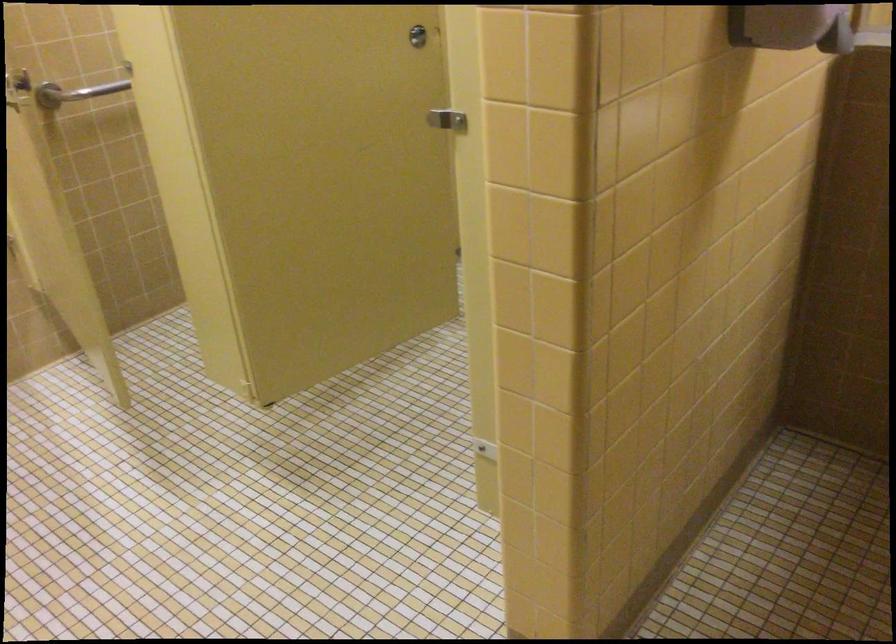
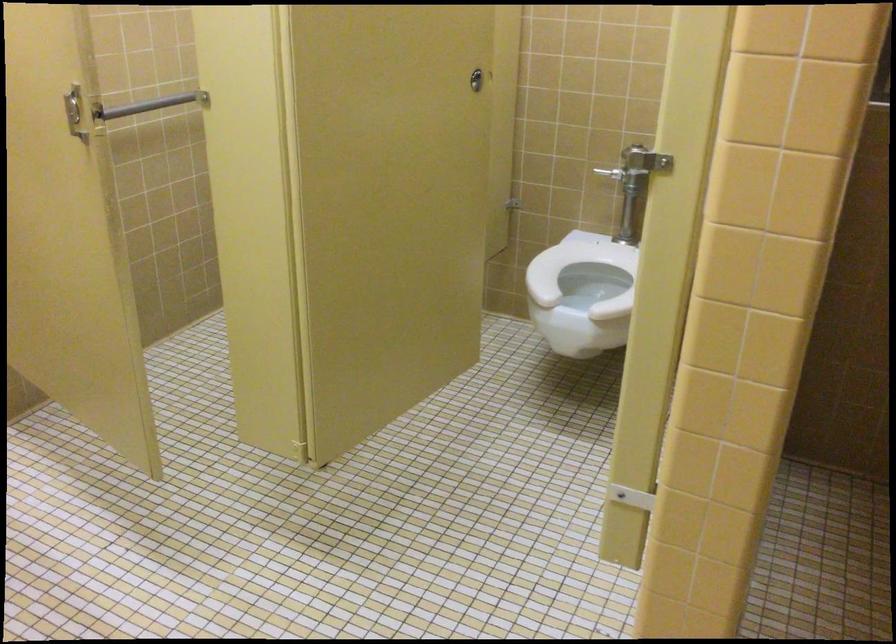
Question: In a continuous first-person perspective shot, in which direction is the camera moving?

Choices:
 (A) Left
 (B) Right
 (C) Forward
 (D) Backward

Answer: (A)